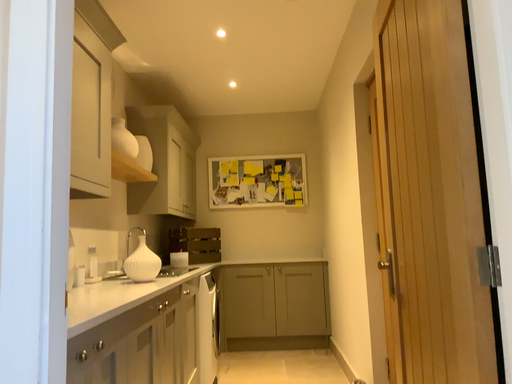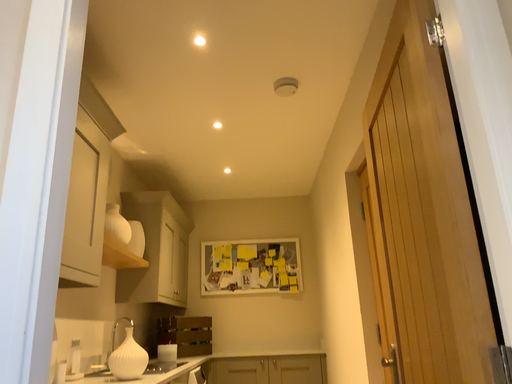
Question: Which way did the camera rotate in the video?

Choices:
 (A) rotated downward
 (B) rotated upward

Answer: (B)